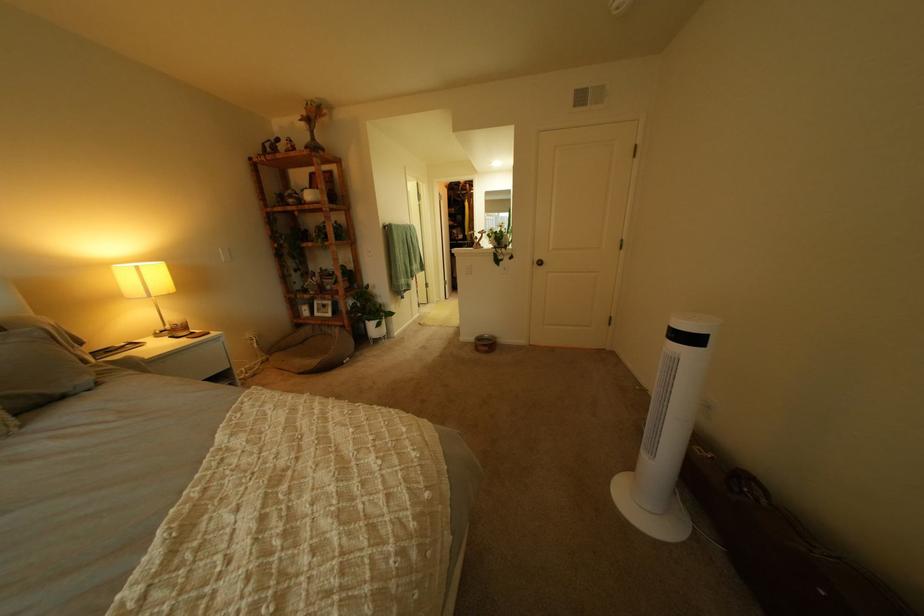
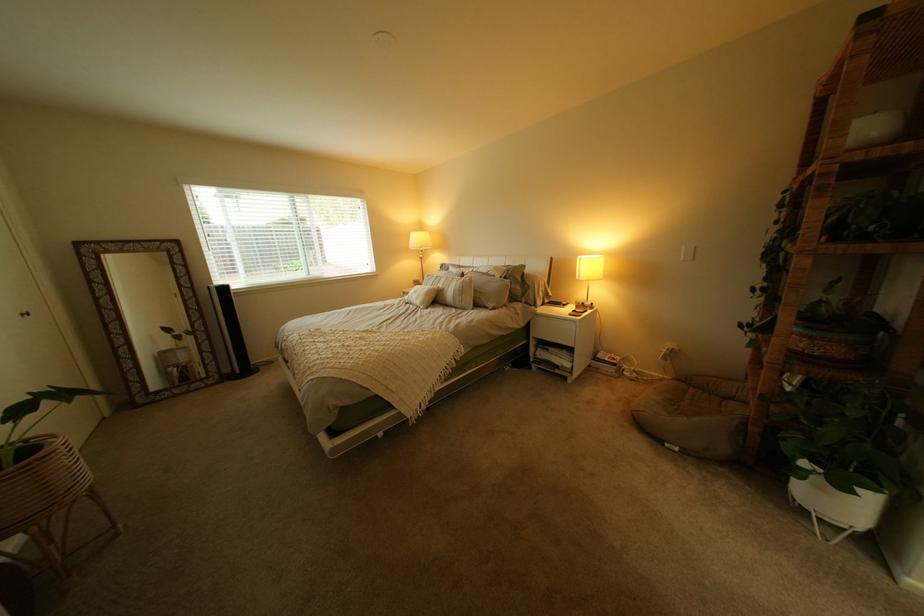
Find the pixel in the second image that matches (360,290) in the first image.

(805, 354)